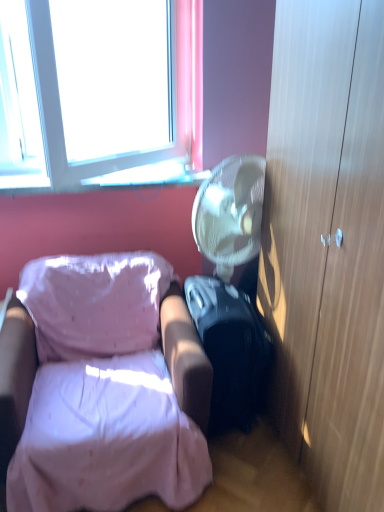
Question: In the image, is transparent glass window sill at upper left positioned in front of or behind wooden cabinet at right?

Choices:
 (A) behind
 (B) front

Answer: (A)

Question: From a real-world perspective, is transparent glass window sill at upper left physically located above or below wooden cabinet at right?

Choices:
 (A) below
 (B) above

Answer: (B)

Question: Which is nearer to the pink fabric chair at lower left?

Choices:
 (A) black matte suitcase at lower right
 (B) wooden cabinet at right
 (C) transparent glass window sill at upper left

Answer: (A)

Question: Considering the real-world distances, which object is farthest from the pink fabric chair at lower left?

Choices:
 (A) transparent glass window sill at upper left
 (B) wooden cabinet at right
 (C) black matte suitcase at lower right

Answer: (A)